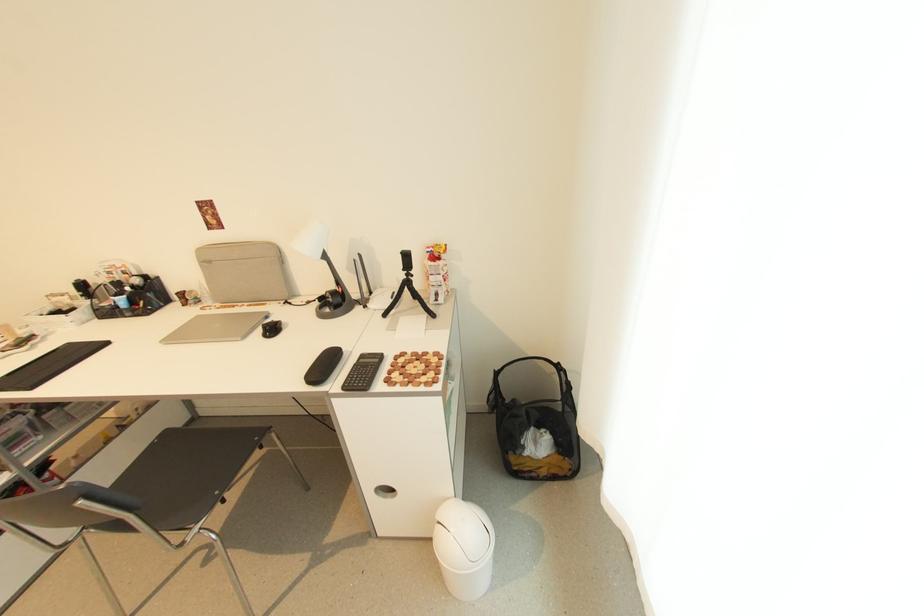
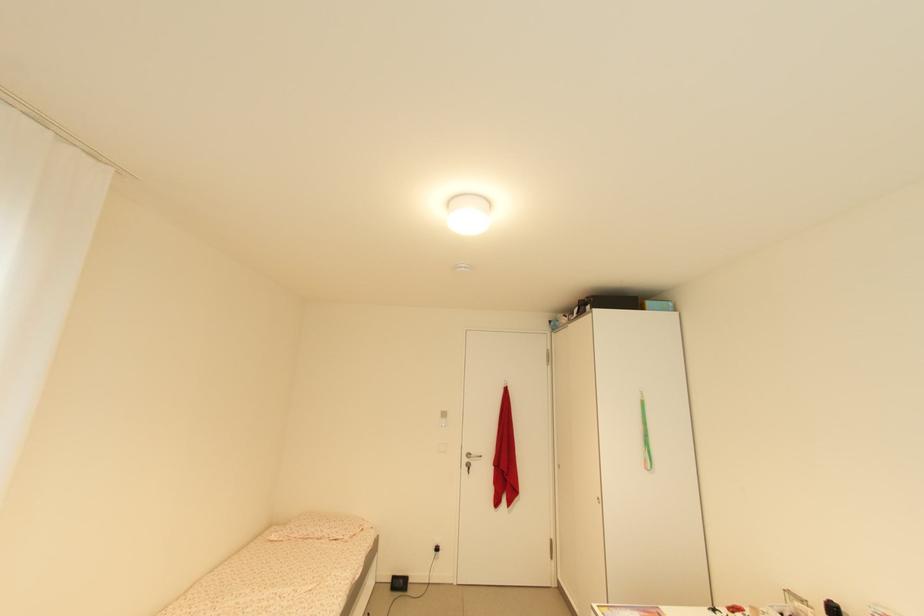
Question: Based on the continuous images, in which direction is the camera rotating? Reply with the corresponding letter.

Choices:
 (A) Left
 (B) Right
 (C) Up
 (D) Down

Answer: (A)